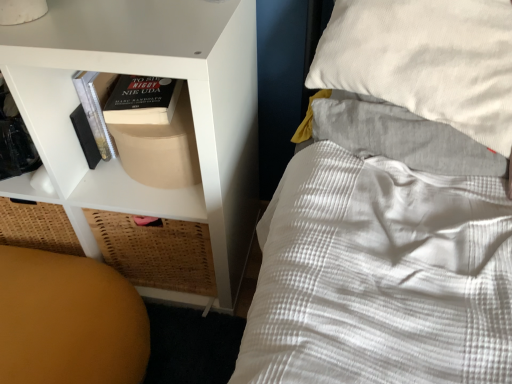
Question: Considering the relative sizes of white matte shelf at left and orange matte ball at lower left in the image provided, is white matte shelf at left shorter than orange matte ball at lower left?

Choices:
 (A) no
 (B) yes

Answer: (A)

Question: Is white matte shelf at left at the left side of orange matte ball at lower left?

Choices:
 (A) no
 (B) yes

Answer: (A)

Question: Is white matte shelf at left to the right of orange matte ball at lower left from the viewer's perspective?

Choices:
 (A) no
 (B) yes

Answer: (B)

Question: Is white matte shelf at left smaller than orange matte ball at lower left?

Choices:
 (A) no
 (B) yes

Answer: (A)

Question: Is the depth of white matte shelf at left less than that of orange matte ball at lower left?

Choices:
 (A) yes
 (B) no

Answer: (A)

Question: Considering the relative sizes of white matte shelf at left and orange matte ball at lower left in the image provided, is white matte shelf at left taller than orange matte ball at lower left?

Choices:
 (A) no
 (B) yes

Answer: (B)

Question: From a real-world perspective, is orange matte ball at lower left positioned under white matte shelf at left based on gravity?

Choices:
 (A) no
 (B) yes

Answer: (B)

Question: Can we say orange matte ball at lower left lies outside white matte shelf at left?

Choices:
 (A) yes
 (B) no

Answer: (A)

Question: Can you confirm if orange matte ball at lower left is wider than white matte shelf at left?

Choices:
 (A) no
 (B) yes

Answer: (B)

Question: Is orange matte ball at lower left taller than white matte shelf at left?

Choices:
 (A) no
 (B) yes

Answer: (A)

Question: Can you confirm if orange matte ball at lower left is positioned to the left of white matte shelf at left?

Choices:
 (A) no
 (B) yes

Answer: (B)

Question: Does orange matte ball at lower left turn towards white matte shelf at left?

Choices:
 (A) no
 (B) yes

Answer: (A)

Question: Is white matte shelf at left in front of or behind orange matte ball at lower left in the image?

Choices:
 (A) front
 (B) behind

Answer: (A)